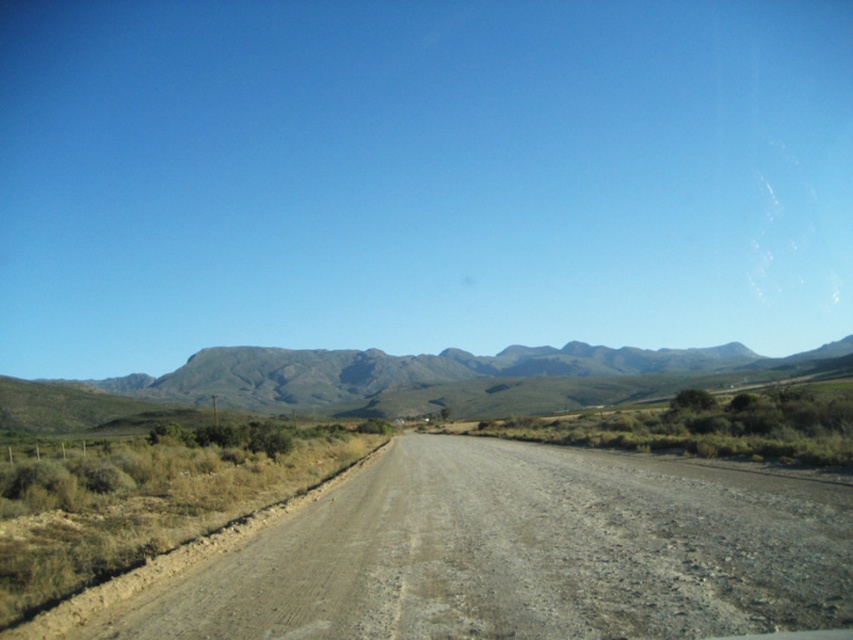
Is dusty gravel road at center to the left of gray rocky mountain at center from the viewer's perspective?

Correct, you'll find dusty gravel road at center to the left of gray rocky mountain at center.

Which of these two, dusty gravel road at center or gray rocky mountain at center, stands taller?

gray rocky mountain at center

Identify the location of dusty gravel road at center. (515, 552).